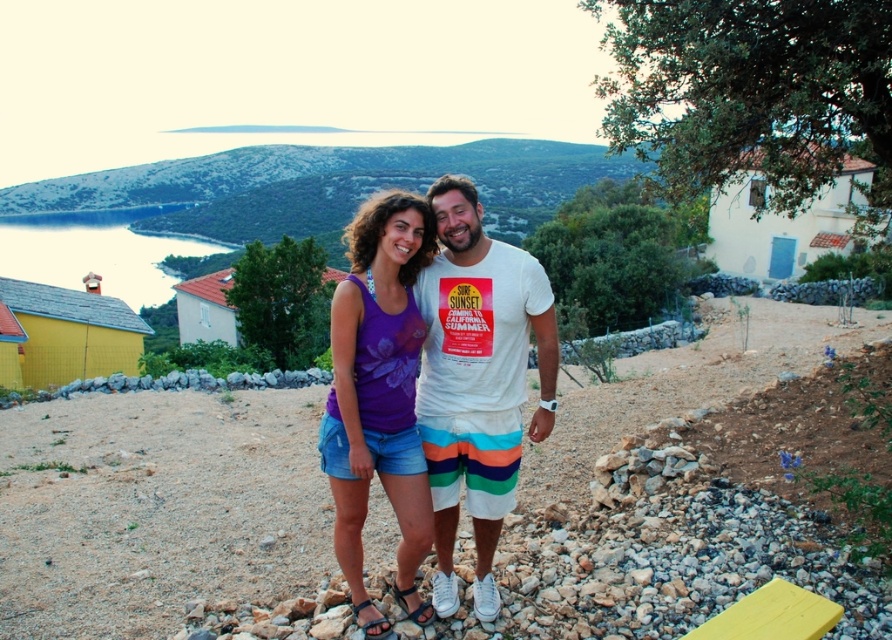
Is white cotton t-shirt at center positioned in front of purple floral tank top at center?

That is False.

Can you confirm if white cotton t-shirt at center is wider than purple floral tank top at center?

No.

Who is more forward, (x=508, y=499) or (x=354, y=340)?

Point (x=354, y=340) is in front.

Identify the location of white cotton t-shirt at center. (477, 380).